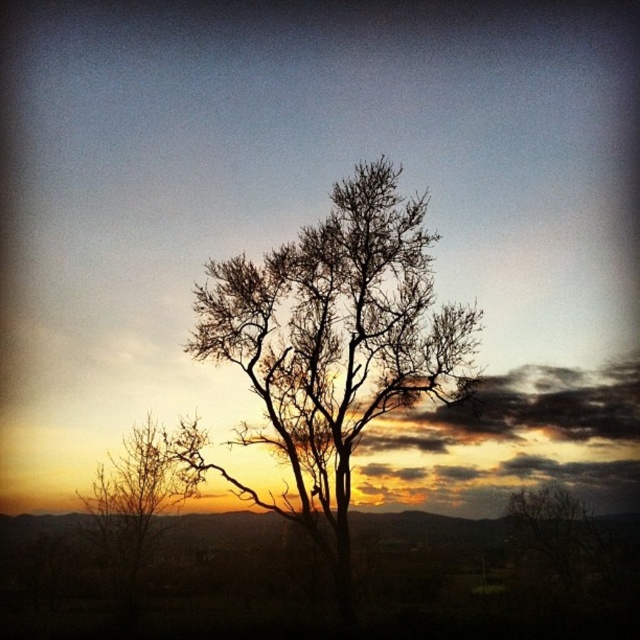
Question: Considering the relative positions of bare branches at left and bare branches at lower right in the image provided, where is bare branches at left located with respect to bare branches at lower right?

Choices:
 (A) below
 (B) above

Answer: (B)

Question: Can you confirm if bare branches at center is positioned to the left of bare branches at lower right?

Choices:
 (A) no
 (B) yes

Answer: (B)

Question: Is bare branches at left smaller than bare branches at lower right?

Choices:
 (A) yes
 (B) no

Answer: (A)

Question: Which point is farther to the camera?

Choices:
 (A) (97, 506)
 (B) (243, 492)

Answer: (A)

Question: Which object is the closest to the bare branches at center?

Choices:
 (A) bare branches at lower right
 (B) bare branches at left

Answer: (A)

Question: Which object is farther from the camera taking this photo?

Choices:
 (A) bare branches at center
 (B) bare branches at lower right

Answer: (B)